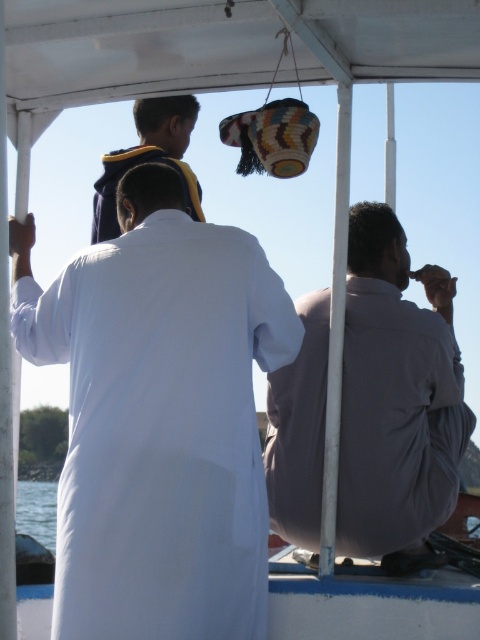
Question: Is gray cotton shirt at right closer to the viewer compared to dark blue hoodie at upper left?

Choices:
 (A) no
 (B) yes

Answer: (B)

Question: Which point appears closest to the camera in this image?

Choices:
 (A) (73, 596)
 (B) (55, 515)

Answer: (A)

Question: Based on their relative distances, which object is nearer to the dark blue hoodie at upper left?

Choices:
 (A) gray cotton shirt at right
 (B) white cloth at center
 (C) clear blue water at lower left

Answer: (B)

Question: Does dark blue hoodie at upper left have a lesser width compared to clear blue water at lower left?

Choices:
 (A) no
 (B) yes

Answer: (B)

Question: Which of the following is the closest to the observer?

Choices:
 (A) (457, 364)
 (B) (186, 429)

Answer: (B)

Question: Considering the relative positions of white cloth at center and clear blue water at lower left in the image provided, where is white cloth at center located with respect to clear blue water at lower left?

Choices:
 (A) below
 (B) above

Answer: (B)